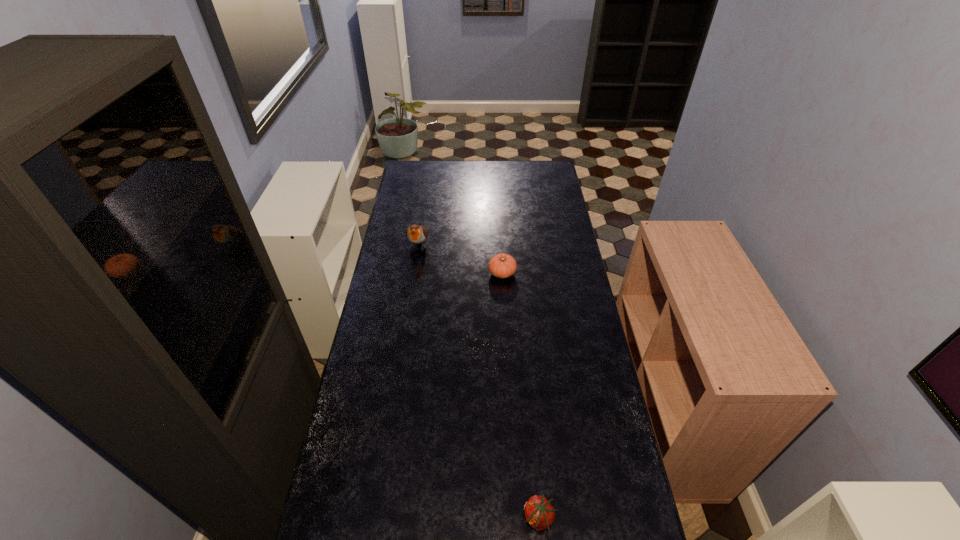
Where is `the tallest object`? The height and width of the screenshot is (540, 960). the tallest object is located at coordinates (416, 234).

Where is `bird`? This screenshot has height=540, width=960. bird is located at coordinates (416, 234).

Where is `the farther tomato`? Image resolution: width=960 pixels, height=540 pixels. the farther tomato is located at coordinates (502, 265).

Find the location of a particular element. The width and height of the screenshot is (960, 540). the taller tomato is located at coordinates (502, 265).

Where is `the nearer tomato`? the nearer tomato is located at coordinates (539, 513).

The width and height of the screenshot is (960, 540). Identify the location of the nearest object. (539, 513).

The image size is (960, 540). In order to click on vacant space located 0.340m at the face of the farthest object in this screenshot , I will do `click(407, 316)`.

You are a GUI agent. You are given a task and a screenshot of the screen. Output one action in this format:
    pyautogui.click(x=<x>, y=<y>)
    Task: Click on the vacant area situated 0.400m on the front of the farther tomato
    The height and width of the screenshot is (540, 960).
    Given the screenshot: What is the action you would take?
    pyautogui.click(x=507, y=363)

The image size is (960, 540). Identify the location of free space located on the left of the shortest object. (486, 518).

Where is `object present at the left edge`? object present at the left edge is located at coordinates (416, 234).